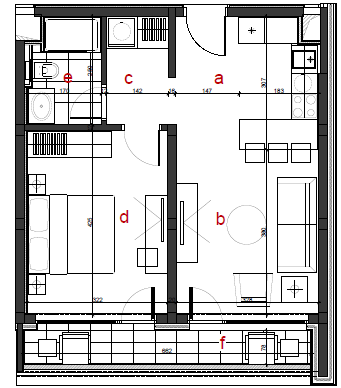
At what (x,y) coordinates should I click in order to perform the action: click on closet. Please return your answer as a coordinate pair (x, y). Image resolution: width=341 pixels, height=388 pixels. Looking at the image, I should click on (46, 145), (152, 33).